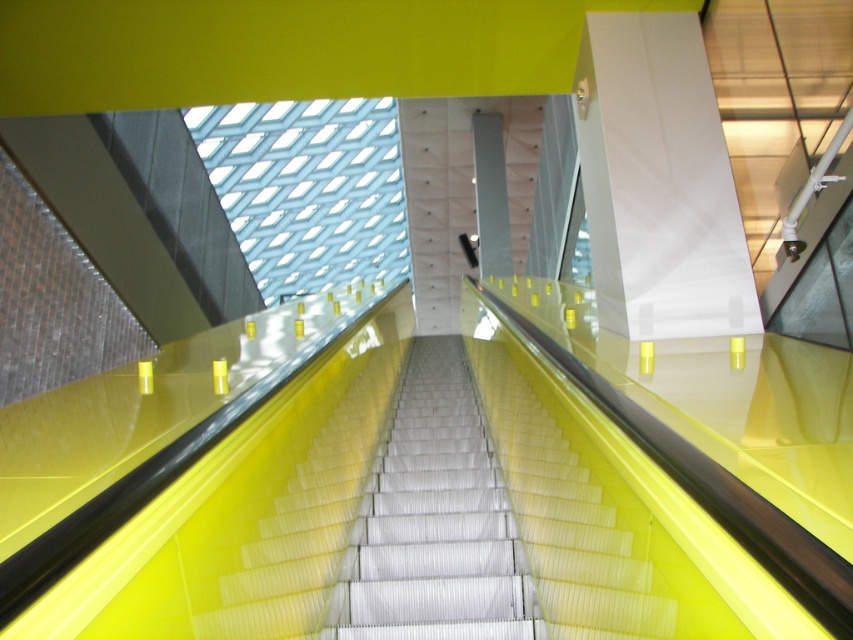
Question: Which point appears farthest from the camera in this image?

Choices:
 (A) (376, 630)
 (B) (544, 397)

Answer: (B)

Question: Can you confirm if white glossy stairs at center is positioned to the right of yellow glossy stairs at center?

Choices:
 (A) yes
 (B) no

Answer: (B)

Question: Does white glossy stairs at center appear on the left side of yellow glossy stairs at center?

Choices:
 (A) yes
 (B) no

Answer: (A)

Question: Does white glossy stairs at center appear under yellow glossy stairs at center?

Choices:
 (A) yes
 (B) no

Answer: (A)

Question: Which point is farther from the camera taking this photo?

Choices:
 (A) (535, 580)
 (B) (375, 609)

Answer: (B)